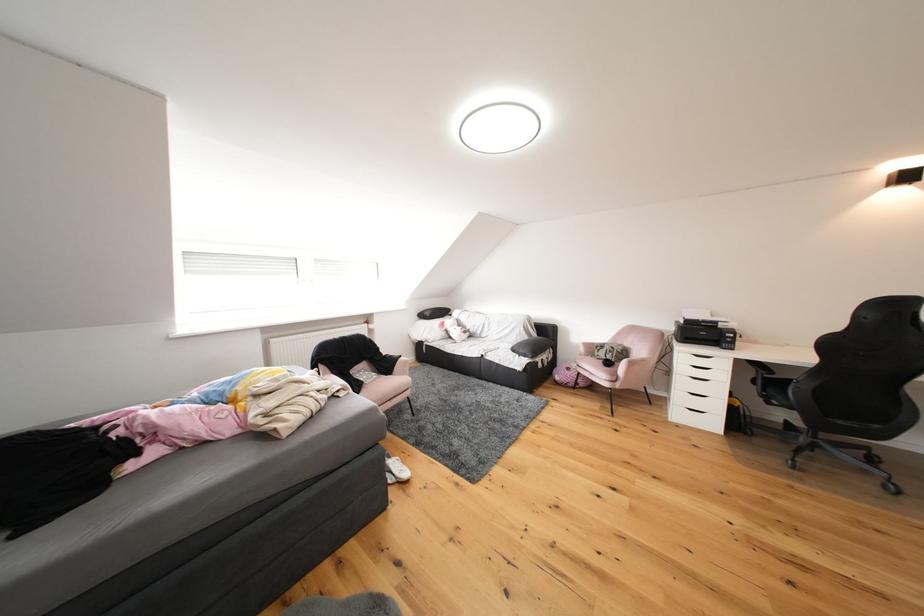
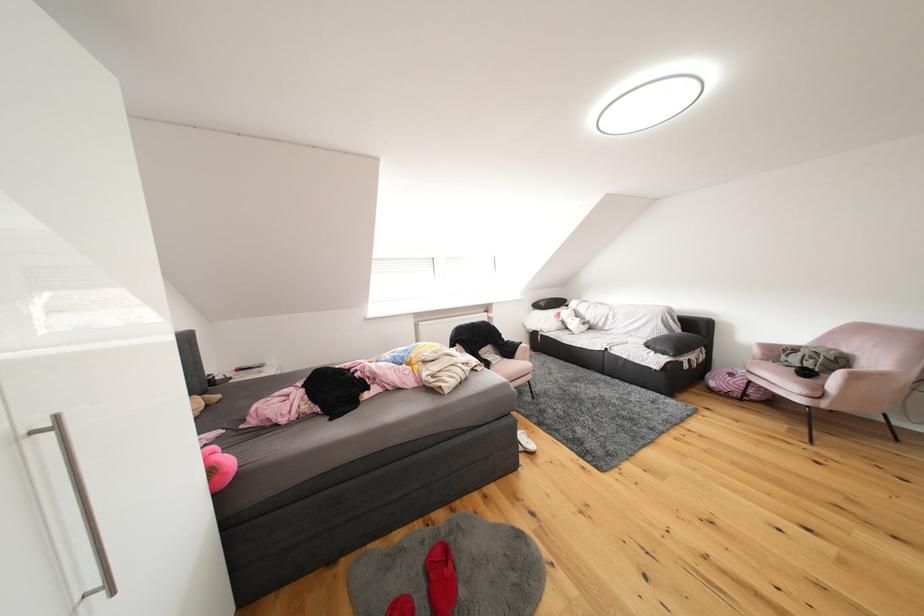
Where in the second image is the point corresponding to point (627, 389) from the first image?

(834, 408)